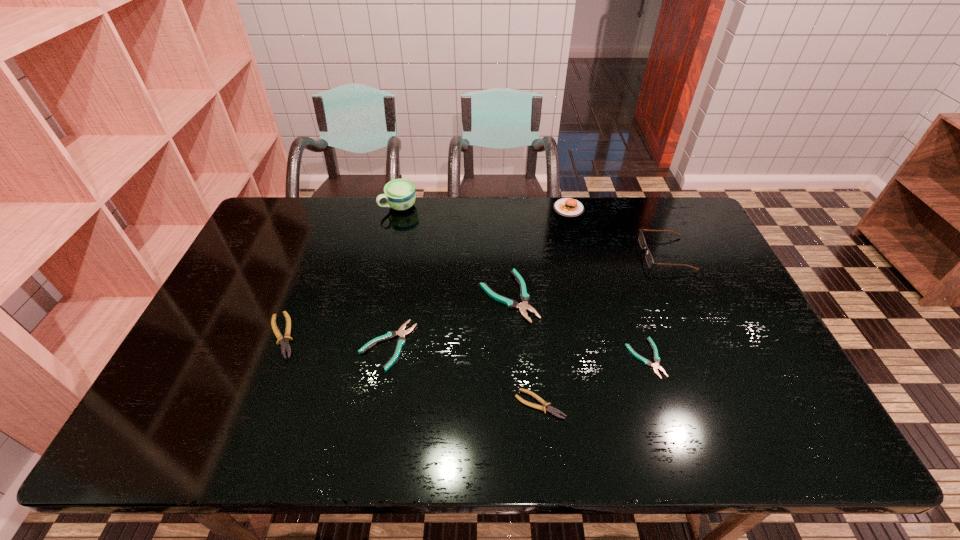
What are the coordinates of `vacant position in the image that satisfies the following two spatial constraints: 1. on the back side of the blue cup; 2. on the right side of the farther yellow pliers` in the screenshot? It's located at (333, 206).